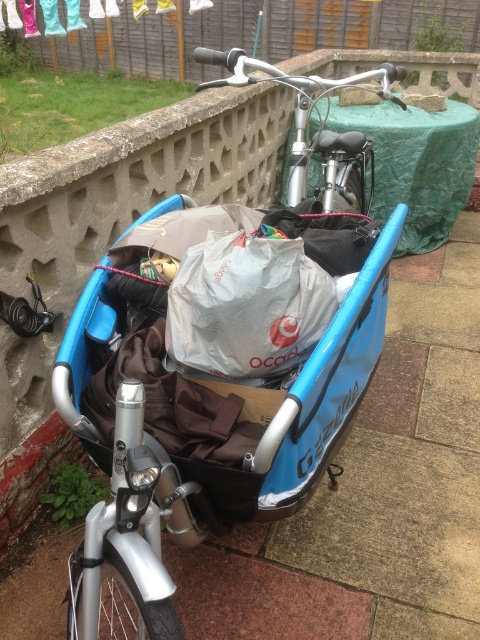
You are standing at point (219, 365) in the scene. What object is located exactly at your current position?

The blue matte cargo bike at center is located exactly at point (219, 365).

You are a delivery person who needs to park your blue matte cargo bike at center and silver metallic bicycle at upper center in a narrow alley. The alley is only 60 centimeters wide. Can both bikes fit side by side without overlapping?

The blue matte cargo bike at center and silver metallic bicycle at upper center are 66.77 centimeters apart from each other. Since the alley is only 60 centimeters wide, the two bikes cannot fit side by side without overlapping as they require more space than available.

You are a delivery person trying to navigate through a narrow alley. You see the blue matte cargo bike at center and the silver metallic bicycle at upper center. Which bicycle should you avoid hitting first to prevent blocking the path?

The blue matte cargo bike at center is in front of the silver metallic bicycle at upper center, so you should avoid hitting the blue matte cargo bike at center first to prevent blocking the path.